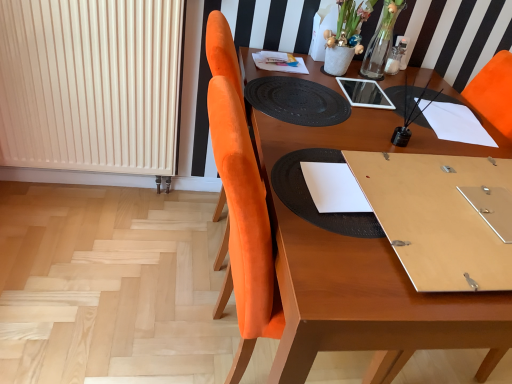
Question: Considering the relative sizes of white paper at center and white ribbed radiator at left in the image provided, is white paper at center taller than white ribbed radiator at left?

Choices:
 (A) no
 (B) yes

Answer: (A)

Question: Is white paper at center in contact with white ribbed radiator at left?

Choices:
 (A) no
 (B) yes

Answer: (A)

Question: Does white paper at center lie in front of white ribbed radiator at left?

Choices:
 (A) no
 (B) yes

Answer: (B)

Question: From a real-world perspective, is white paper at center beneath white ribbed radiator at left?

Choices:
 (A) yes
 (B) no

Answer: (B)

Question: Is white paper at center wider than white ribbed radiator at left?

Choices:
 (A) no
 (B) yes

Answer: (B)

Question: From the image's perspective, relative to white paper at center, is wooden table at center above or below?

Choices:
 (A) below
 (B) above

Answer: (A)

Question: Considering the positions of wooden table at center and white paper at center in the image, is wooden table at center wider or thinner than white paper at center?

Choices:
 (A) thin
 (B) wide

Answer: (B)

Question: Looking at the image, does wooden table at center seem bigger or smaller compared to white paper at center?

Choices:
 (A) small
 (B) big

Answer: (B)

Question: Is wooden table at center taller or shorter than white paper at center?

Choices:
 (A) short
 (B) tall

Answer: (B)

Question: Based on their sizes in the image, would you say white ribbed radiator at left is bigger or smaller than black textured placemat at center?

Choices:
 (A) small
 (B) big

Answer: (B)

Question: Considering the positions of point (136, 125) and point (279, 79), is point (136, 125) closer or farther from the camera than point (279, 79)?

Choices:
 (A) farther
 (B) closer

Answer: (A)

Question: Is white ribbed radiator at left to the left or to the right of black textured placemat at center in the image?

Choices:
 (A) right
 (B) left

Answer: (B)

Question: Considering the positions of white ribbed radiator at left and black textured placemat at center in the image, is white ribbed radiator at left wider or thinner than black textured placemat at center?

Choices:
 (A) wide
 (B) thin

Answer: (B)

Question: Do you think black textured placemat at center is within black textured placemat at center, or outside of it?

Choices:
 (A) inside
 (B) outside

Answer: (B)

Question: In terms of size, does black textured placemat at center appear bigger or smaller than black textured placemat at center?

Choices:
 (A) small
 (B) big

Answer: (A)